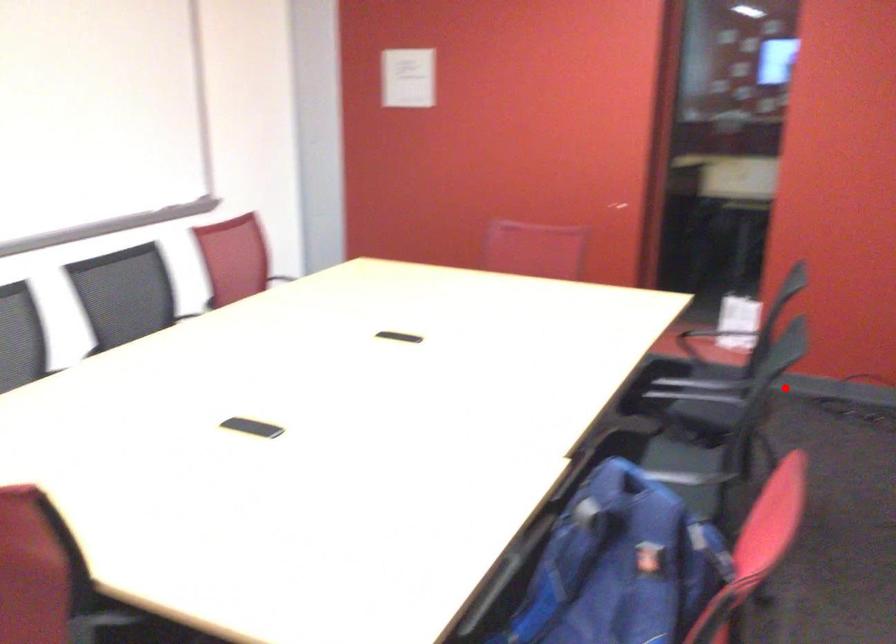
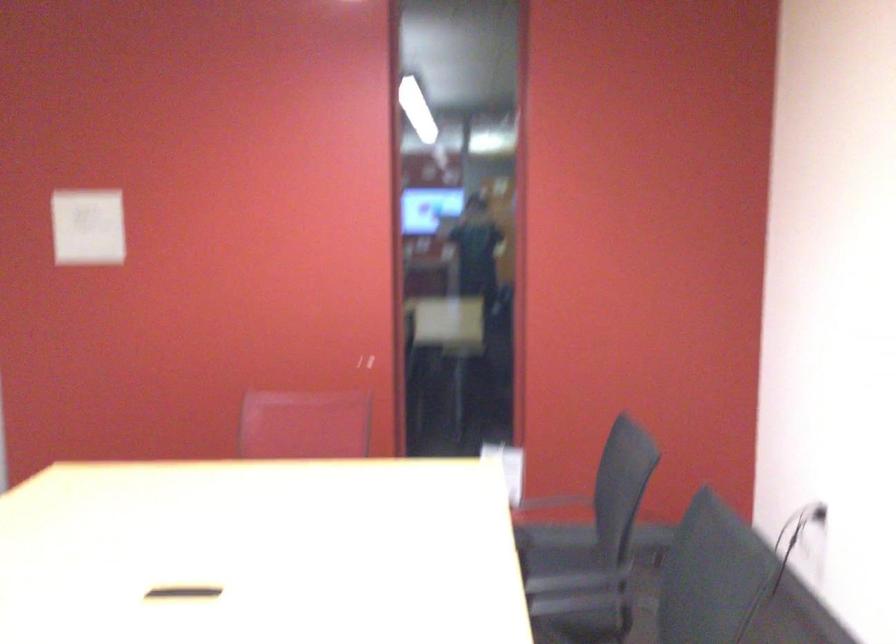
Find the pixel in the second image that matches the highlighted location in the first image.

(554, 547)